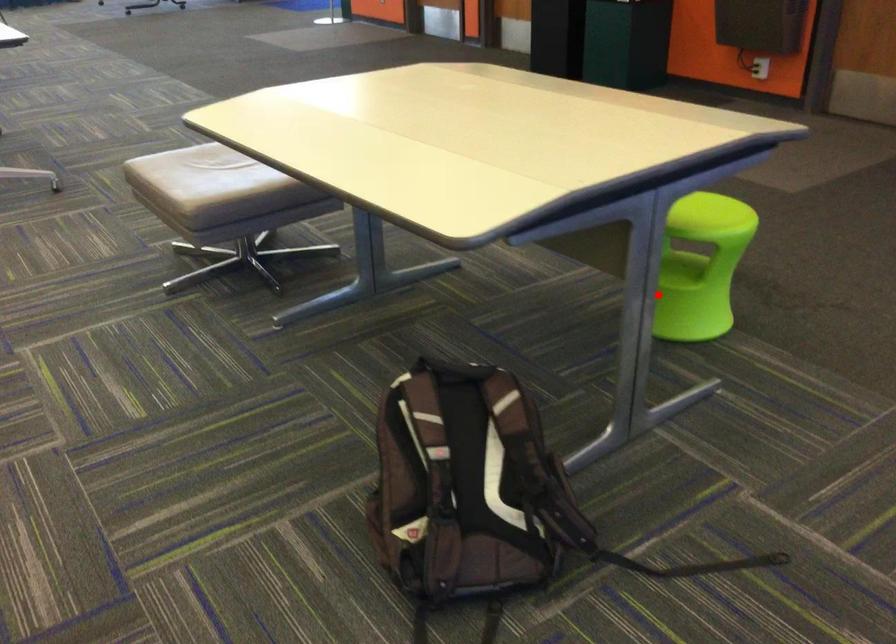
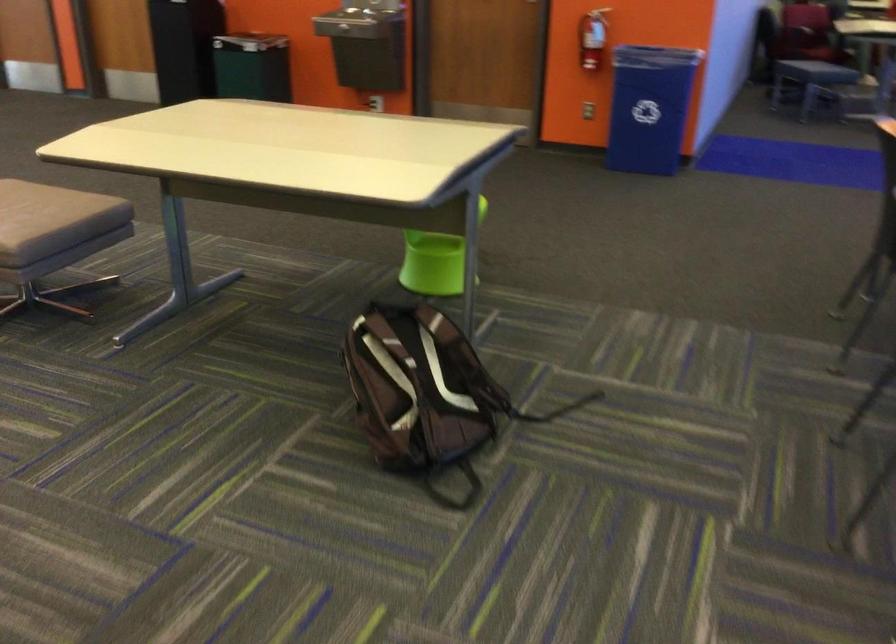
Find the pixel in the second image that matches the highlighted location in the first image.

(435, 261)